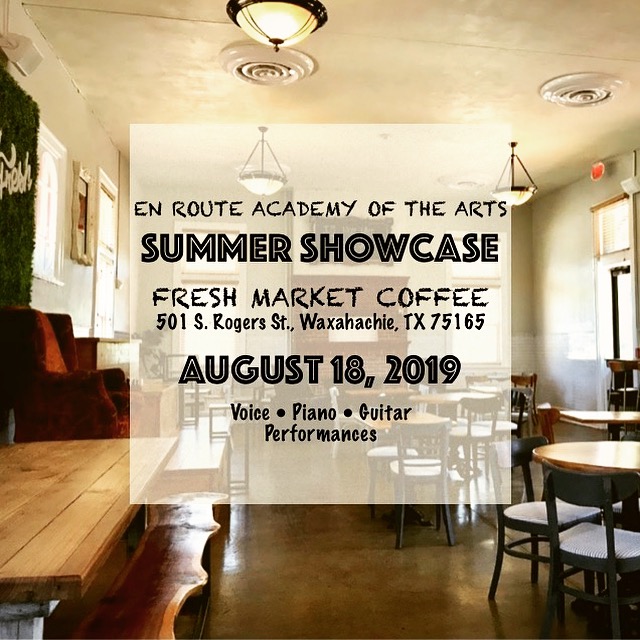
Identify the location of vents. (278, 73), (596, 93).